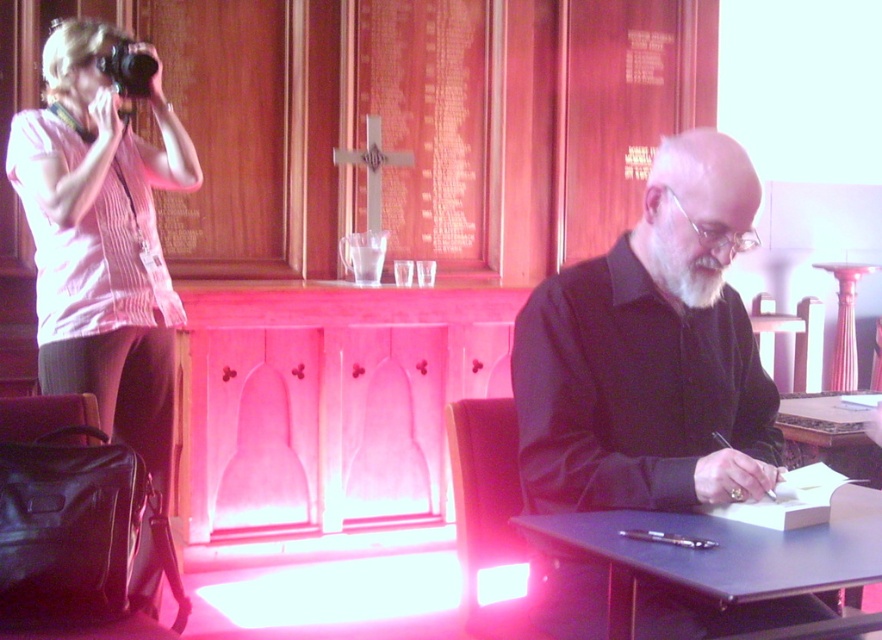
Can you confirm if pink striped shirt at left is positioned below black plastic camera at upper left?

Yes, pink striped shirt at left is below black plastic camera at upper left.

Between pink striped shirt at left and black plastic camera at upper left, which one appears on the right side from the viewer's perspective?

From the viewer's perspective, pink striped shirt at left appears more on the right side.

The width and height of the screenshot is (882, 640). What do you see at coordinates (102, 241) in the screenshot?
I see `pink striped shirt at left` at bounding box center [102, 241].

Identify the location of pink striped shirt at left. The image size is (882, 640). (102, 241).

Does black matte shirt at center have a smaller size compared to black plastic camera at upper left?

Actually, black matte shirt at center might be larger than black plastic camera at upper left.

In the scene shown: Between black matte shirt at center and black plastic camera at upper left, which one has more height?

Standing taller between the two is black matte shirt at center.

Between point (682, 355) and point (141, 84), which one is positioned behind?

The point (141, 84) is behind.

The image size is (882, 640). In order to click on black matte shirt at center in this screenshot , I will do `click(651, 355)`.

Which is above, pink striped shirt at left or black plastic table at lower right?

Positioned higher is pink striped shirt at left.

Does point (111, 177) lie in front of point (755, 573)?

No, it is not.

Measure the distance between point (163, 381) and camera.

Point (163, 381) and camera are 2.77 meters apart.

Where is `pink striped shirt at left`? pink striped shirt at left is located at coordinates click(102, 241).